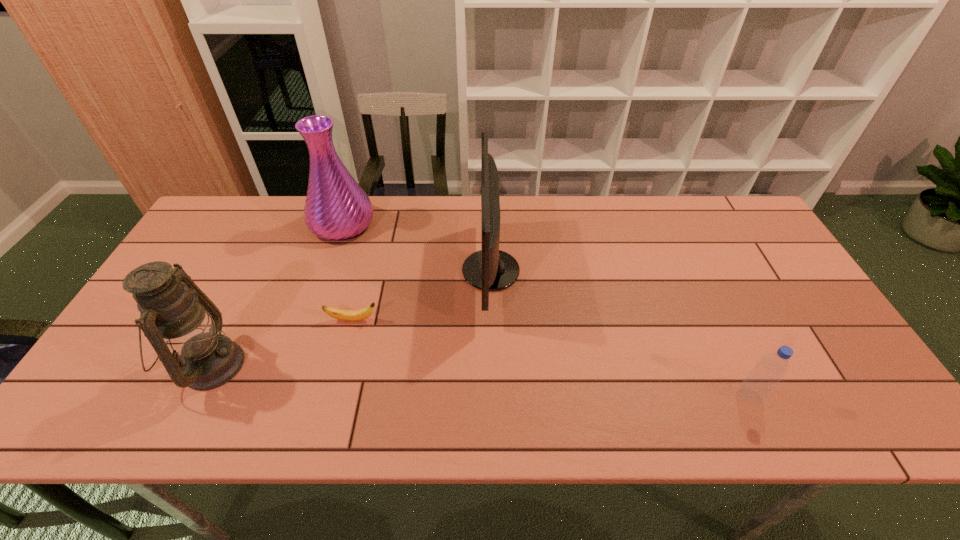
Locate an element on the screen. The width and height of the screenshot is (960, 540). vacant region located 0.280m on the back of the leftmost object is located at coordinates (265, 255).

Where is `free space located 0.340m on the back of the rightmost object`? This screenshot has width=960, height=540. free space located 0.340m on the back of the rightmost object is located at coordinates (694, 279).

Find the location of a particular element. free space located at the stem of the shortest object is located at coordinates (464, 320).

I want to click on vase that is at the far edge, so click(336, 208).

Locate an element on the screen. Image resolution: width=960 pixels, height=540 pixels. monitor at the far edge is located at coordinates (490, 269).

What are the coordinates of `oil lamp at the near edge` in the screenshot? It's located at (175, 314).

This screenshot has width=960, height=540. I want to click on bottle positioned at the near edge, so click(x=769, y=371).

Locate an element on the screen. The width and height of the screenshot is (960, 540). object that is at the left edge is located at coordinates (175, 314).

Identify the location of object that is at the near left corner. (175, 314).

Locate an element on the screen. free region at the far edge of the desktop is located at coordinates (651, 214).